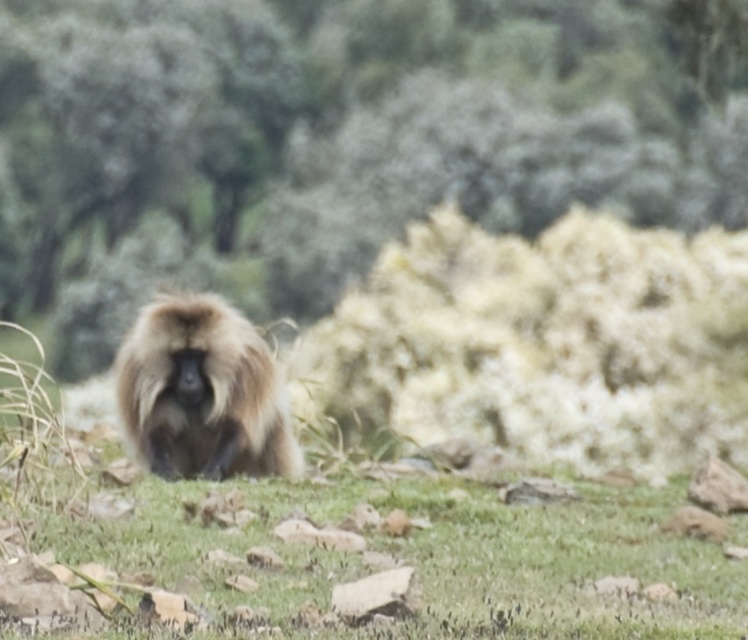
Question: Does green leafy tree at center come behind fuzzy brown monkey at center?

Choices:
 (A) no
 (B) yes

Answer: (B)

Question: Is green leafy tree at center positioned behind fuzzy brown monkey at center?

Choices:
 (A) yes
 (B) no

Answer: (A)

Question: Which of the following is the farthest from the observer?

Choices:
 (A) fuzzy brown monkey at center
 (B) green leafy tree at center

Answer: (B)

Question: Does green leafy tree at center have a smaller size compared to fuzzy brown monkey at center?

Choices:
 (A) yes
 (B) no

Answer: (A)

Question: Which point is closer to the camera?

Choices:
 (A) fuzzy brown monkey at center
 (B) green leafy tree at center

Answer: (A)